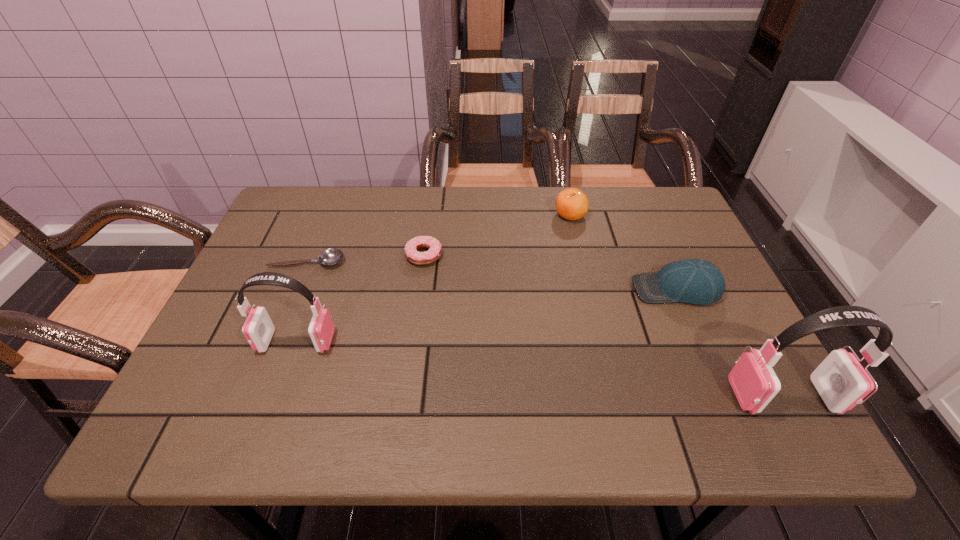
Find the location of a particular element. the left earphone is located at coordinates (258, 329).

The image size is (960, 540). What are the coordinates of `the second nearest object` in the screenshot? It's located at (258, 329).

Where is `the tallest object`? This screenshot has width=960, height=540. the tallest object is located at coordinates (841, 381).

At what (x,y) coordinates should I click in order to perform the action: click on the nearest object. Please return your answer as a coordinate pair (x, y). The image size is (960, 540). Looking at the image, I should click on (841, 381).

Identify the location of the third object from right to left. The width and height of the screenshot is (960, 540). (572, 204).

Where is `the farthest object`? the farthest object is located at coordinates [572, 204].

Where is `baseball cap`? baseball cap is located at coordinates (694, 281).

I want to click on the fifth tallest object, so (x=411, y=248).

Where is `the third object from left to right`? The width and height of the screenshot is (960, 540). the third object from left to right is located at coordinates (411, 248).

Identify the location of ladle. (332, 256).